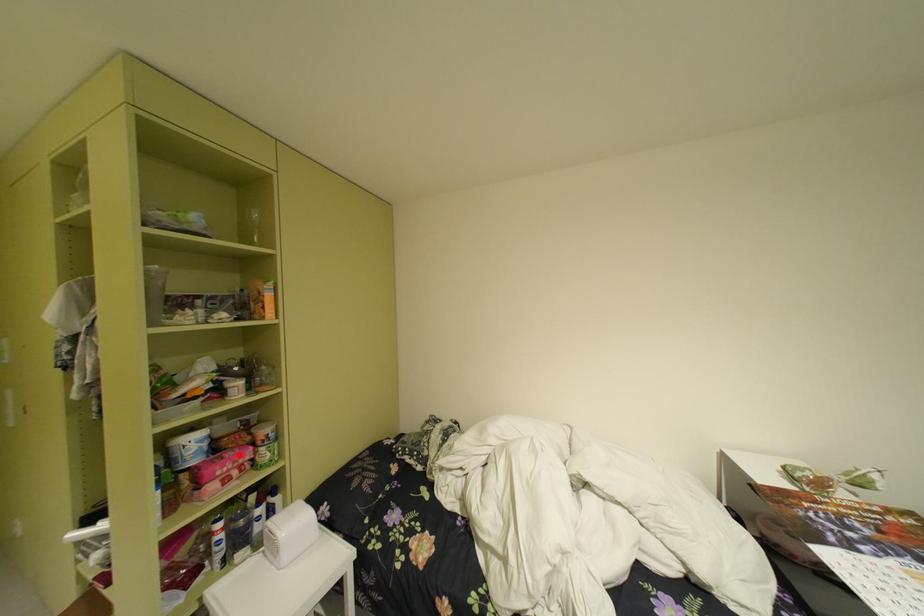
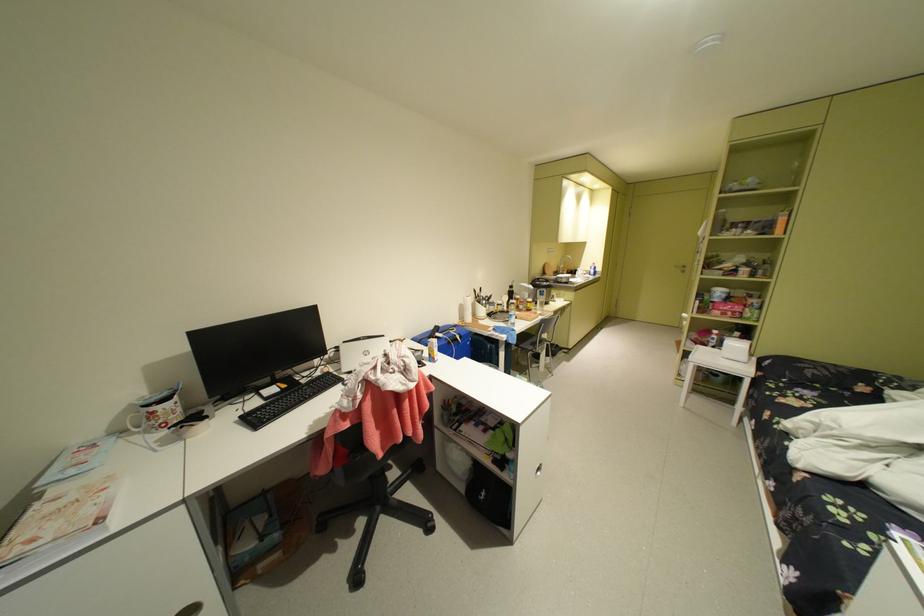
Where in the second image is the point corresponding to the highlighted location from the first image?

(740, 304)